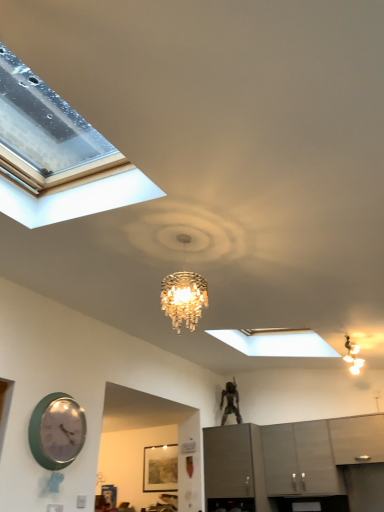
Question: Looking at the image, does matte gray cabinet at center, placed as the 3th cabinetry when sorted from right to left, seem bigger or smaller compared to wooden textured picture frame at center?

Choices:
 (A) big
 (B) small

Answer: (A)

Question: From a real-world perspective, is matte gray cabinet at center, which is the 1th cabinetry from left to right, above or below wooden textured picture frame at center?

Choices:
 (A) below
 (B) above

Answer: (A)

Question: Considering the real-world distances, which object is farthest from the matte gray cabinet at lower right, the 1th cabinetry viewed from the right?

Choices:
 (A) wooden textured picture frame at center
 (B) satin gray cabinets at lower right, positioned as the second cabinetry in left-to-right order
 (C) matte gray cabinet at center, placed as the 3th cabinetry when sorted from right to left
 (D) green glossy wall clock at lower left

Answer: (D)

Question: Considering the real-world distances, which object is closest to the green glossy wall clock at lower left?

Choices:
 (A) matte gray cabinet at lower right, the 1th cabinetry viewed from the right
 (B) wooden textured picture frame at center
 (C) matte gray cabinet at center, which is the 1th cabinetry from left to right
 (D) satin gray cabinets at lower right, positioned as the second cabinetry in left-to-right order

Answer: (C)